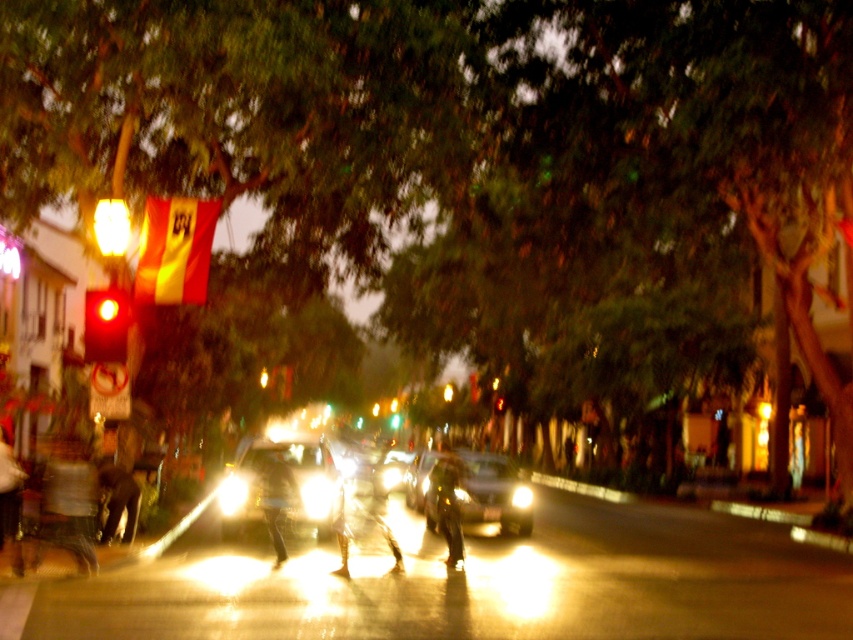
How much distance is there between shiny silver car at center and metallic gold person at center?

shiny silver car at center is 3.76 meters from metallic gold person at center.

Which is above, shiny silver car at center or metallic gold person at center?

metallic gold person at center

This screenshot has width=853, height=640. What do you see at coordinates (282, 483) in the screenshot?
I see `shiny silver car at center` at bounding box center [282, 483].

The image size is (853, 640). I want to click on shiny silver car at center, so click(282, 483).

What do you see at coordinates (448, 506) in the screenshot? I see `metallic silver pants at center` at bounding box center [448, 506].

Is metallic silver pants at center smaller than green glass traffic light at center?

Correct, metallic silver pants at center occupies less space than green glass traffic light at center.

Where is `metallic silver pants at center`? The height and width of the screenshot is (640, 853). metallic silver pants at center is located at coordinates (448, 506).

This screenshot has height=640, width=853. In order to click on metallic silver pants at center in this screenshot , I will do `click(448, 506)`.

Is point (465, 476) closer to camera compared to point (114, 339)?

That is False.

Between shiny silver sedan at center and red glass traffic light at left, which one is positioned higher?

Positioned higher is red glass traffic light at left.

Is point (515, 477) positioned in front of point (103, 337)?

No, it is not.

Locate an element on the screen. This screenshot has height=640, width=853. shiny silver sedan at center is located at coordinates (473, 490).